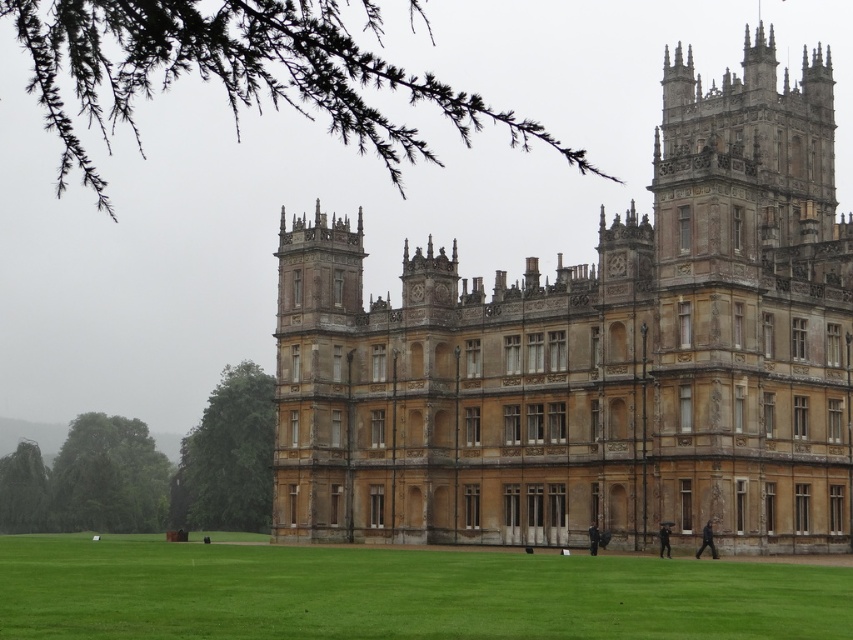
At what (x,y) coordinates should I click in order to perform the action: click on golden stone castle at center. Please return your answer as a coordinate pair (x, y). The width and height of the screenshot is (853, 640). Looking at the image, I should click on (595, 355).

Who is positioned more to the right, golden stone castle at center or dark gray suit at lower right?

dark gray suit at lower right

This screenshot has width=853, height=640. Describe the element at coordinates (595, 355) in the screenshot. I see `golden stone castle at center` at that location.

Locate an element on the screen. The height and width of the screenshot is (640, 853). golden stone castle at center is located at coordinates (595, 355).

How far apart are golden stone castle at center and dark blue fabric coat at lower center?

golden stone castle at center and dark blue fabric coat at lower center are 19.52 meters apart from each other.

Does golden stone castle at center lie behind dark blue fabric coat at lower center?

No, golden stone castle at center is in front of dark blue fabric coat at lower center.

Does point (479, 291) come behind point (595, 538)?

Yes, it is.

Where is `golden stone castle at center`? golden stone castle at center is located at coordinates pos(595,355).

Does dark gray suit at lower right appear under dark gray fabric coat at lower right?

Yes.

Is the position of dark gray suit at lower right less distant than that of dark gray fabric coat at lower right?

Yes.

Locate an element on the screen. Image resolution: width=853 pixels, height=640 pixels. dark gray suit at lower right is located at coordinates (706, 540).